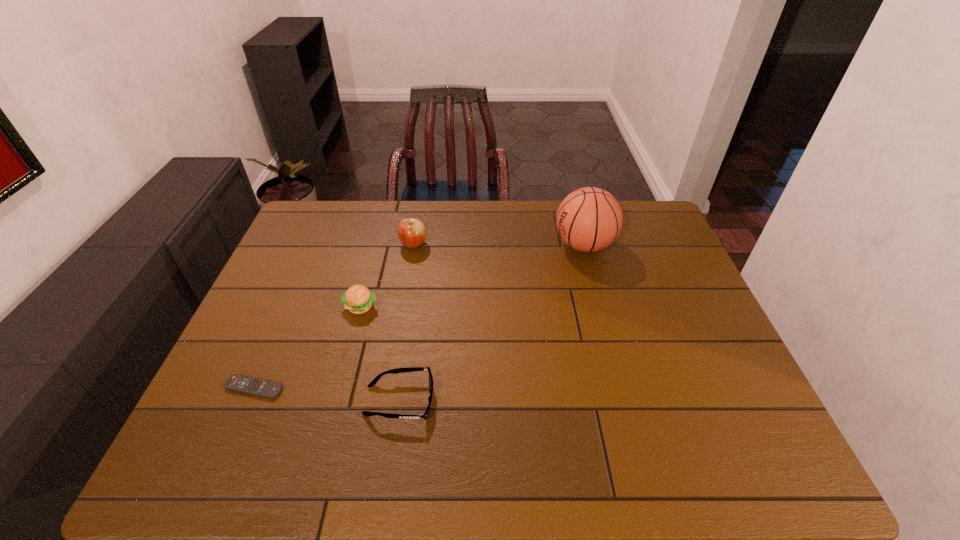
This screenshot has height=540, width=960. Find the location of `unoccupied area between the third nearest object and the tallest object`. unoccupied area between the third nearest object and the tallest object is located at coordinates point(472,276).

Locate an element on the screen. The image size is (960, 540). free spot between the third nearest object and the fourth tallest object is located at coordinates (380, 354).

Select which object appears as the closest to the apple. Please provide its 2D coordinates. Your answer should be formatted as a tuple, i.e. [(x, y)], where the tuple contains the x and y coordinates of a point satisfying the conditions above.

[(358, 299)]

Identify which object is the third closest to the sunglasses. Please provide its 2D coordinates. Your answer should be formatted as a tuple, i.e. [(x, y)], where the tuple contains the x and y coordinates of a point satisfying the conditions above.

[(412, 233)]